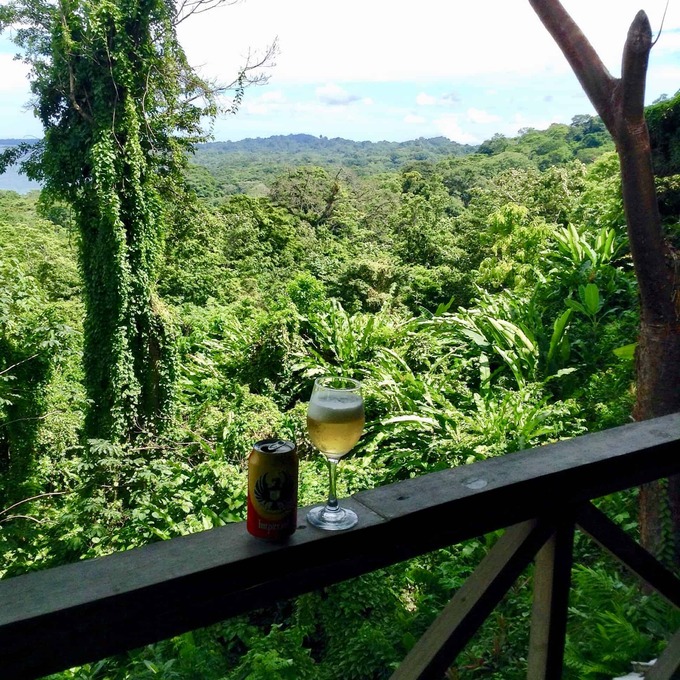
Where is `wooden rail`? This screenshot has width=680, height=680. wooden rail is located at coordinates (443, 503).